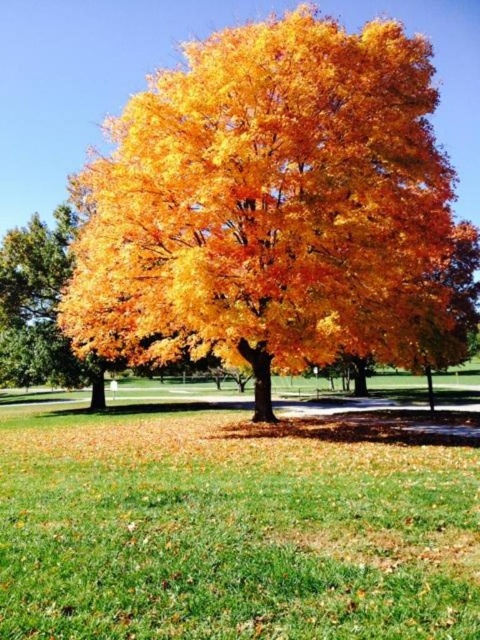
Does golden yellow leaves at center lie behind green grass at center?

Yes, it is behind green grass at center.

Which is in front, point (212, 42) or point (326, 570)?

Positioned in front is point (326, 570).

This screenshot has width=480, height=640. I want to click on golden yellow leaves at center, so click(x=265, y=204).

Identify the location of golden yellow leaves at center. The image size is (480, 640). (265, 204).